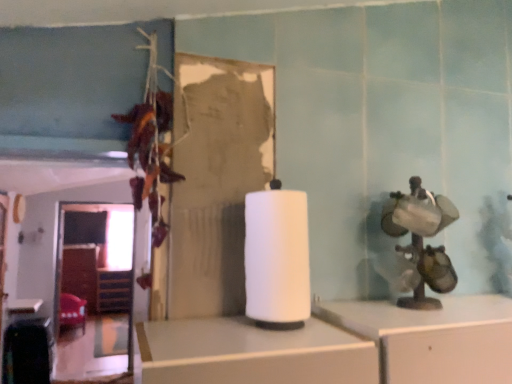
Question: Considering the relative sizes of velvet red chair at lower left and white matte paper towel at center in the image provided, is velvet red chair at lower left bigger than white matte paper towel at center?

Choices:
 (A) yes
 (B) no

Answer: (A)

Question: Considering the relative sizes of velvet red chair at lower left and white matte paper towel at center in the image provided, is velvet red chair at lower left smaller than white matte paper towel at center?

Choices:
 (A) no
 (B) yes

Answer: (A)

Question: From a real-world perspective, is velvet red chair at lower left beneath white matte paper towel at center?

Choices:
 (A) yes
 (B) no

Answer: (A)

Question: Can you confirm if velvet red chair at lower left is taller than white matte paper towel at center?

Choices:
 (A) no
 (B) yes

Answer: (B)

Question: Considering the relative sizes of velvet red chair at lower left and white matte paper towel at center in the image provided, is velvet red chair at lower left thinner than white matte paper towel at center?

Choices:
 (A) yes
 (B) no

Answer: (B)

Question: Based on their positions, is white matte paper towel at center located to the left or right of velvet red chair at lower left?

Choices:
 (A) left
 (B) right

Answer: (B)

Question: From the image's perspective, is white matte paper towel at center located above or below velvet red chair at lower left?

Choices:
 (A) above
 (B) below

Answer: (A)

Question: In terms of height, does white matte paper towel at center look taller or shorter compared to velvet red chair at lower left?

Choices:
 (A) tall
 (B) short

Answer: (B)

Question: Is white matte paper towel at center inside the boundaries of velvet red chair at lower left, or outside?

Choices:
 (A) inside
 (B) outside

Answer: (B)

Question: Is wooden at left taller or shorter than white matte paper towel at center?

Choices:
 (A) short
 (B) tall

Answer: (B)

Question: Considering the relative positions of wooden at left and white matte paper towel at center in the image provided, is wooden at left to the left or to the right of white matte paper towel at center?

Choices:
 (A) right
 (B) left

Answer: (B)

Question: Is wooden at left inside the boundaries of white matte paper towel at center, or outside?

Choices:
 (A) inside
 (B) outside

Answer: (B)

Question: Considering the positions of point (97, 294) and point (285, 286), is point (97, 294) closer or farther from the camera than point (285, 286)?

Choices:
 (A) farther
 (B) closer

Answer: (A)

Question: Is velvet red chair at lower left in front of or behind white matte paper towel at center in the image?

Choices:
 (A) front
 (B) behind

Answer: (B)

Question: Is point (68, 312) positioned closer to the camera than point (262, 309)?

Choices:
 (A) farther
 (B) closer

Answer: (A)